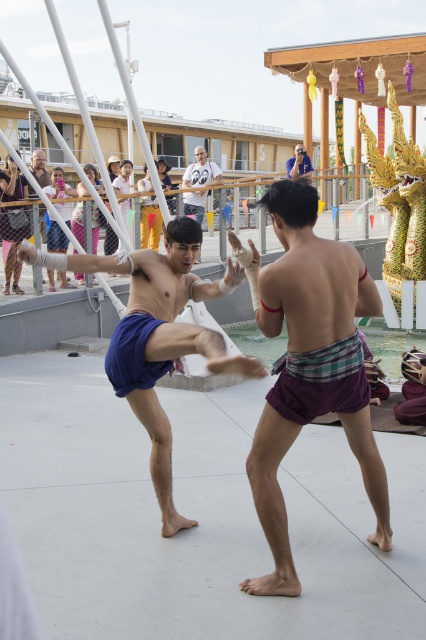
You are a photographer at the event and want to capture a photo where the purple plaid shorts at center and the light blue shirt at upper center are both clearly visible. Based on their positions, which object should be placed higher in the frame to ensure both are in focus?

The light blue shirt at upper center should be placed higher in the frame since it is positioned above the purple plaid shorts at center, allowing both to be in focus while maintaining their natural spatial relationship.

You are a photographer at the event and want to capture a photo where both the blue cotton shorts at center and the light blue shirt at upper center are visible. Based on their positions, which object should you focus on first to ensure both are in frame?

The blue cotton shorts at center is positioned under the light blue shirt at upper center, so focusing on the light blue shirt at upper center first will ensure both are in frame since the shorts are below it.

You are a photographer at a martial arts event. You need to capture a photo where the blue cotton shorts at center and the light blue shirt at upper center are both visible. Based on their positions, which object should be on the left side of your camera frame?

The blue cotton shorts at center should be on the left side of the camera frame because it is positioned on the left side of the light blue shirt at upper center.